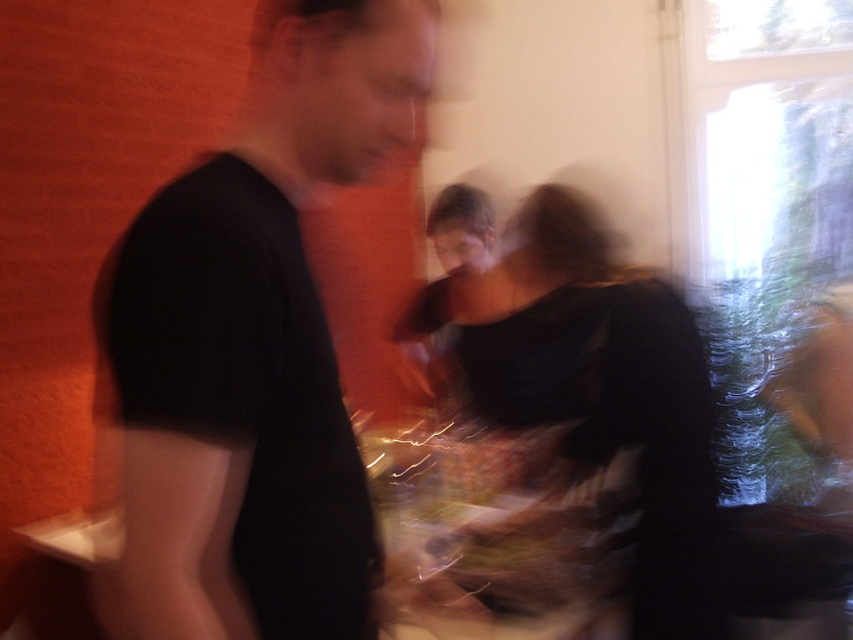
Can you confirm if black matte shirt at left is wider than matte black dress at center?

In fact, black matte shirt at left might be narrower than matte black dress at center.

Between point (199, 189) and point (554, 221), which one is positioned in front?

Point (199, 189) is more forward.

Where is `black matte shirt at left`? black matte shirt at left is located at coordinates (254, 349).